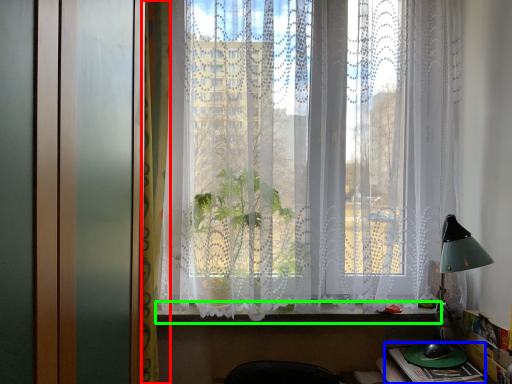
Question: Based on their relative distances, which object is nearer to curtain (highlighted by a red box)? Choose from book (highlighted by a blue box) and window sill (highlighted by a green box).

Choices:
 (A) book
 (B) window sill

Answer: (B)